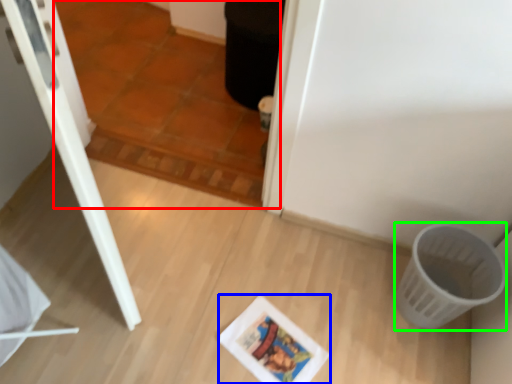
Question: Estimate the real-world distances between objects in this image. Which object is closer to tile (highlighted by a red box), comic book (highlighted by a blue box) or basket (highlighted by a green box)?

Choices:
 (A) comic book
 (B) basket

Answer: (A)